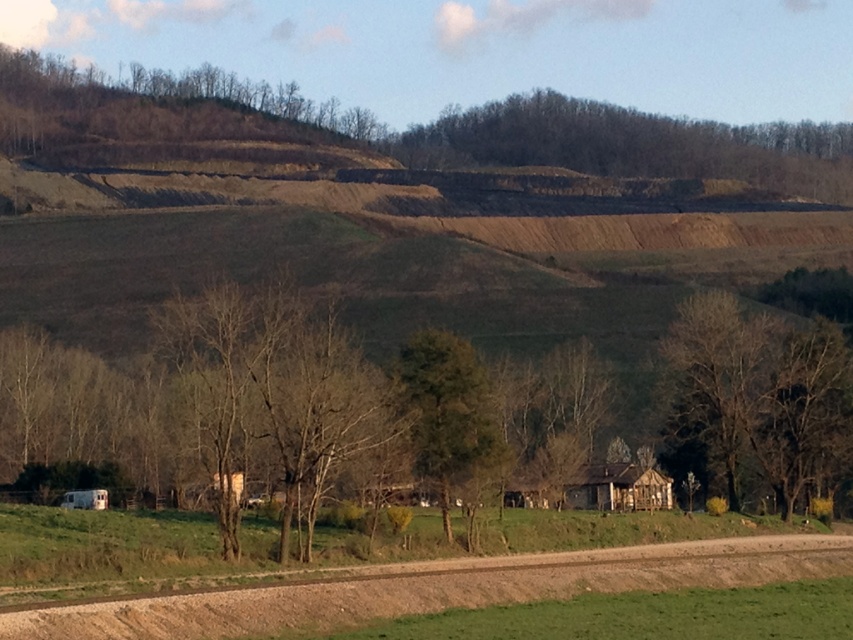
Which of these two, brown textured hillside at upper center or brown textured tree at center, stands shorter?

Standing shorter between the two is brown textured tree at center.

Does brown textured hillside at upper center have a smaller size compared to brown textured tree at center?

No.

You are a GUI agent. You are given a task and a screenshot of the screen. Output one action in this format:
    pyautogui.click(x=<x>, y=<y>)
    Task: Click on the brown textured hillside at upper center
    The height and width of the screenshot is (640, 853).
    Given the screenshot: What is the action you would take?
    pyautogui.click(x=634, y=145)

You are a GUI agent. You are given a task and a screenshot of the screen. Output one action in this format:
    pyautogui.click(x=<x>, y=<y>)
    Task: Click on the brown textured hillside at upper center
    Image resolution: width=853 pixels, height=640 pixels.
    Given the screenshot: What is the action you would take?
    pyautogui.click(x=634, y=145)

Is brown textured hillside at upper center positioned before weathered wood hut at center?

That is False.

Where is `brown textured hillside at upper center`? brown textured hillside at upper center is located at coordinates (634, 145).

Locate an element on the screen. Image resolution: width=853 pixels, height=640 pixels. brown textured hillside at upper center is located at coordinates (634, 145).

Who is more forward, (613, 150) or (433, 484)?

Positioned in front is point (433, 484).

Does point (738, 157) come behind point (451, 403)?

That is True.

The height and width of the screenshot is (640, 853). What do you see at coordinates (634, 145) in the screenshot? I see `brown textured hillside at upper center` at bounding box center [634, 145].

This screenshot has height=640, width=853. I want to click on brown textured hillside at upper center, so click(634, 145).